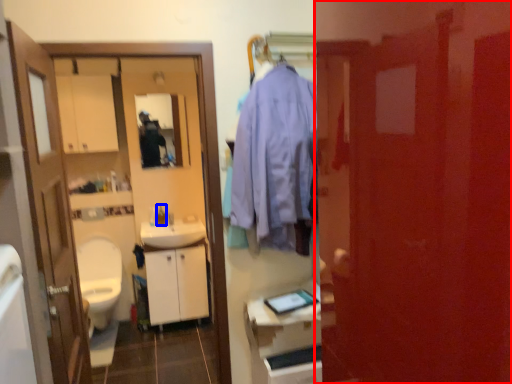
Question: Which of the following is the closest to the observer, door (highlighted by a red box) or toiletry (highlighted by a blue box)?

Choices:
 (A) door
 (B) toiletry

Answer: (A)